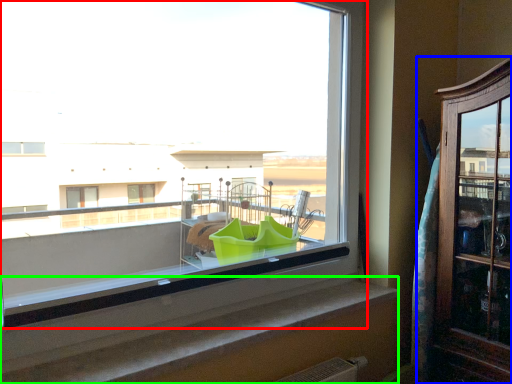
Question: Which is farther away from window (highlighted by a red box)? dresser (highlighted by a blue box) or window sill (highlighted by a green box)?

Choices:
 (A) dresser
 (B) window sill

Answer: (B)